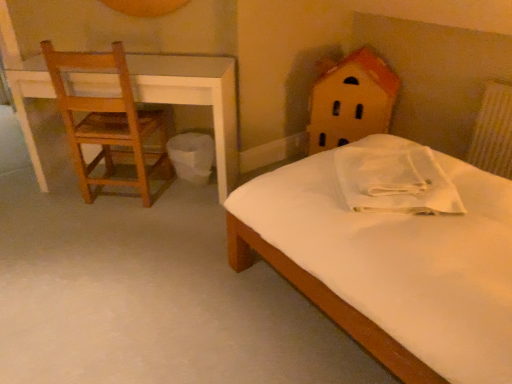
Question: Considering the positions of wooden house at upper right and white textured radiator at right in the image, is wooden house at upper right wider or thinner than white textured radiator at right?

Choices:
 (A) wide
 (B) thin

Answer: (A)

Question: From a real-world perspective, is wooden house at upper right positioned above or below white textured radiator at right?

Choices:
 (A) below
 (B) above

Answer: (A)

Question: Based on their relative distances, which object is farther from the white plastic trash bin at lower center?

Choices:
 (A) white textured radiator at right
 (B) white matte bed at center
 (C) white cotton pillow at center
 (D) wooden house at upper right
 (E) wooden chair at left

Answer: (A)

Question: Estimate the real-world distances between objects in this image. Which object is farther from the wooden chair at left?

Choices:
 (A) wooden house at upper right
 (B) white textured radiator at right
 (C) white matte bed at center
 (D) white plastic trash bin at lower center
 (E) white cotton pillow at center

Answer: (B)